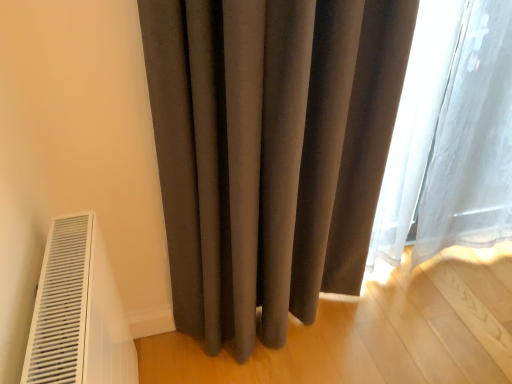
What do you see at coordinates (451, 134) in the screenshot? This screenshot has width=512, height=384. I see `matte gray curtain at right` at bounding box center [451, 134].

Identify the location of matte gray curtain at right. (451, 134).

The width and height of the screenshot is (512, 384). Find the location of `matte gray curtain at right`. matte gray curtain at right is located at coordinates (451, 134).